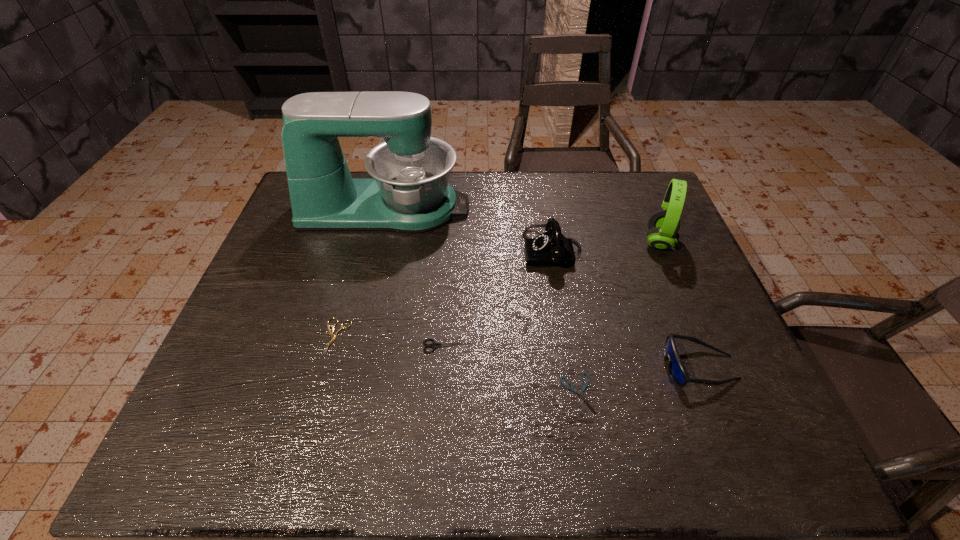
Locate which object is the sixth closest to the second shortest object. Please provide its 2D coordinates. Your answer should be formatted as a tuple, i.e. [(x, y)], where the tuple contains the x and y coordinates of a point satisfying the conditions above.

[(663, 225)]

Identify which shears is located as the second nearest to the leftmost shears. Please provide its 2D coordinates. Your answer should be formatted as a tuple, i.e. [(x, y)], where the tuple contains the x and y coordinates of a point satisfying the conditions above.

[(572, 388)]

Identify the location of shears that is the second closest to the telephone. (572, 388).

I want to click on free space that satisfies the following two spatial constraints: 1. on the back side of the nearest shears; 2. on the front-facing side of the tallest object, so click(x=546, y=208).

Find the location of `vacant space that satisfies the following two spatial constraints: 1. on the front-facing side of the tallest shears; 2. on the left side of the tallest object`. vacant space that satisfies the following two spatial constraints: 1. on the front-facing side of the tallest shears; 2. on the left side of the tallest object is located at coordinates (352, 346).